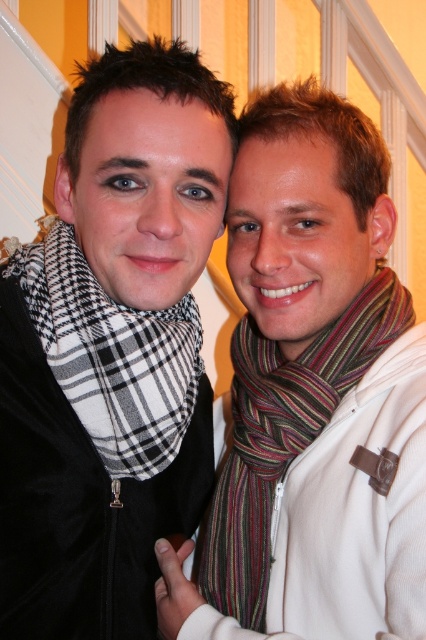
You are holding a camera and want to take a closeup photo of the striped wool scarf at right. The camera requires at least 24 inches of space to focus properly. Based on the scene, will you be able to take the photo without moving the camera closer?

The distance between the striped wool scarf at right and the camera is 26.27 inches, which is more than the required 24 inches. Therefore, you can take the closeup photo without moving the camera closer.

You are a photographer setting up a shoot in this indoor scene. You need to adjust the lighting so that both the striped wool scarf at right and the black checkered scarf at left are equally illuminated. Based on their positions, which scarf should you focus the light on more to achieve this?

The striped wool scarf at right is closer to the viewer than the black checkered scarf at left. To equally illuminate both, focus more light on the black checkered scarf at left since it is farther away and requires more light to appear equally bright.

You are a photographer setting up a shoot in this indoor scene. You need to position a light source so that it illuminates the striped wool scarf at right without affecting the black checkered scarf at left. Based on their positions, where should you place the light relative to the two scarves?

Since the striped wool scarf at right is below the black checkered scarf at left, you should position the light source below the striped wool scarf at right. This way, the light will shine upward toward the scarf while avoiding the higher positioned black checkered scarf at left.